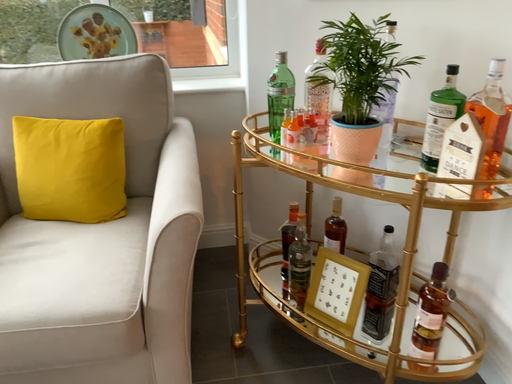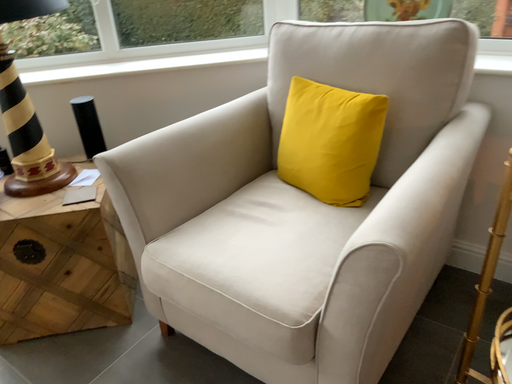
Question: How did the camera likely rotate when shooting the video?

Choices:
 (A) rotated right
 (B) rotated left

Answer: (B)